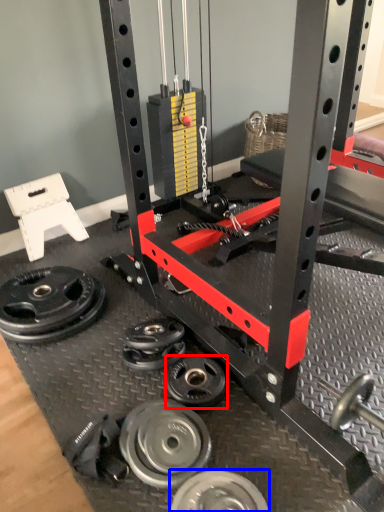
Question: Among these objects, which one is nearest to the camera, wheel (highlighted by a red box) or wheel (highlighted by a blue box)?

Choices:
 (A) wheel
 (B) wheel

Answer: (B)